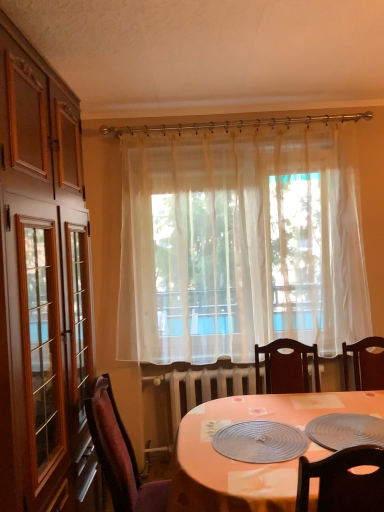
Question: From the image's perspective, is metallic silver platter at lower right, which is the 1th platter in right-to-left order, above or below metallic textured platter at center, the 1th platter when ordered from left to right?

Choices:
 (A) below
 (B) above

Answer: (B)

Question: In terms of height, does metallic silver platter at lower right, which is the 1th platter in right-to-left order, look taller or shorter compared to metallic textured platter at center, the 1th platter when ordered from left to right?

Choices:
 (A) tall
 (B) short

Answer: (A)

Question: Which is nearer to the metallic textured platter at center, the 1th platter when ordered from left to right?

Choices:
 (A) orange fabric table at center
 (B) velvet burgundy chair at lower left
 (C) metallic silver platter at lower right, the 2th platter from the left
 (D) sheer white curtain at center

Answer: (A)

Question: Which object is the farthest from the metallic silver platter at lower right, which is the 1th platter in right-to-left order?

Choices:
 (A) orange fabric table at center
 (B) metallic textured platter at center, which is the 2th platter from right to left
 (C) sheer white curtain at center
 (D) velvet burgundy chair at lower left

Answer: (C)